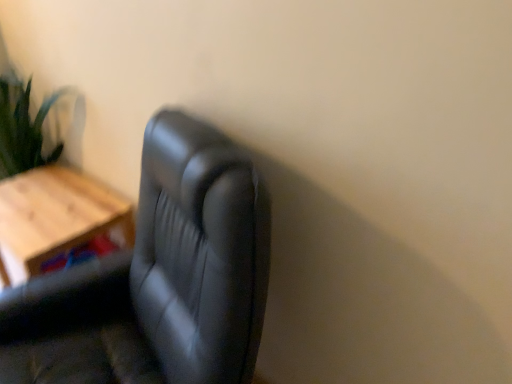
Question: In terms of size, does black leather chair at center appear bigger or smaller than wooden table at left?

Choices:
 (A) small
 (B) big

Answer: (B)

Question: Considering the positions of point (152, 125) and point (8, 258), is point (152, 125) closer or farther from the camera than point (8, 258)?

Choices:
 (A) farther
 (B) closer

Answer: (B)

Question: From the image's perspective, is black leather chair at center above or below wooden table at left?

Choices:
 (A) below
 (B) above

Answer: (A)

Question: From a real-world perspective, is wooden table at left above or below black leather chair at center?

Choices:
 (A) above
 (B) below

Answer: (B)

Question: Does point (72, 198) appear closer or farther from the camera than point (228, 347)?

Choices:
 (A) farther
 (B) closer

Answer: (A)

Question: Relative to black leather chair at center, is wooden table at left in front or behind?

Choices:
 (A) front
 (B) behind

Answer: (B)

Question: Considering the positions of wooden table at left and black leather chair at center in the image, is wooden table at left wider or thinner than black leather chair at center?

Choices:
 (A) thin
 (B) wide

Answer: (A)